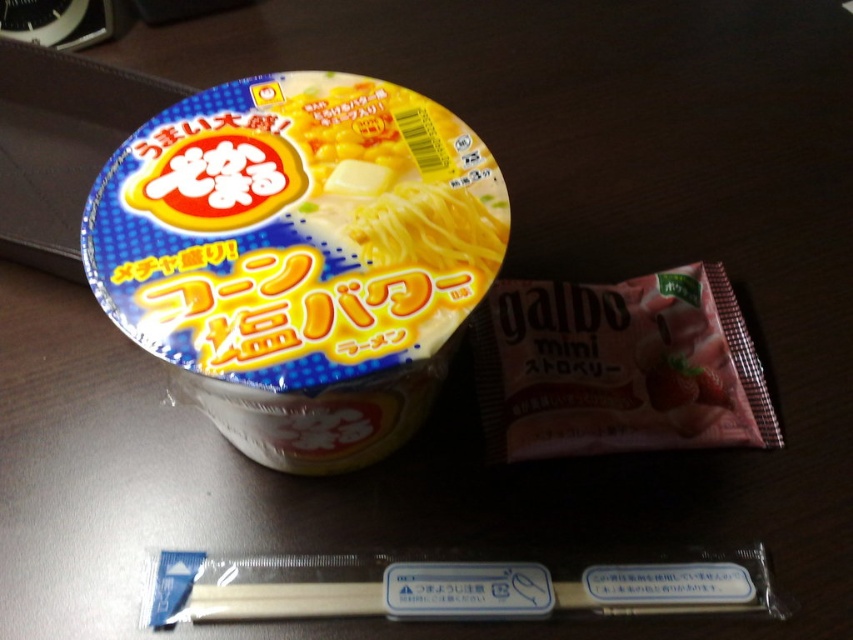
You have a matte plastic cup at center and a pink matte snack at right on a table. Which object is wider?

The matte plastic cup at center is wider than the pink matte snack at right.

You are organizing items on a shelf and need to place the matte plastic cup at center and the pink matte snack at right. According to the image, which item is positioned to the right of the other?

The pink matte snack at right is to the right of the matte plastic cup at center.